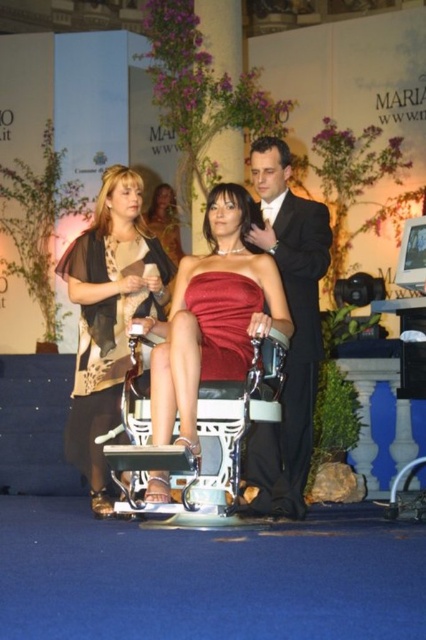
Who is taller, metallic silver chair at center or matte black dress at center?

metallic silver chair at center

Which is above, metallic silver chair at center or matte black dress at center?

matte black dress at center is above.

Is point (212, 458) positioned after point (169, 224)?

No, it is not.

You are a GUI agent. You are given a task and a screenshot of the screen. Output one action in this format:
    pyautogui.click(x=<x>, y=<y>)
    Task: Click on the metallic silver chair at center
    Image resolution: width=426 pixels, height=640 pixels.
    Given the screenshot: What is the action you would take?
    pyautogui.click(x=198, y=435)

Between shiny red dress at center and matte beige dress at center, which one is positioned lower?

matte beige dress at center

Is shiny red dress at center shorter than matte beige dress at center?

Indeed, shiny red dress at center has a lesser height compared to matte beige dress at center.

Between point (218, 237) and point (118, 388), which one is positioned in front?

Point (218, 237)

Locate an element on the screen. This screenshot has width=426, height=640. shiny red dress at center is located at coordinates (213, 316).

Consider the image. Who is higher up, matte beige dress at center or metallic silver chair at center?

matte beige dress at center is higher up.

Between matte beige dress at center and metallic silver chair at center, which one has more height?

matte beige dress at center

You are a GUI agent. You are given a task and a screenshot of the screen. Output one action in this format:
    pyautogui.click(x=<x>, y=<y>)
    Task: Click on the matte beige dress at center
    The height and width of the screenshot is (640, 426).
    Given the screenshot: What is the action you would take?
    pyautogui.click(x=109, y=316)